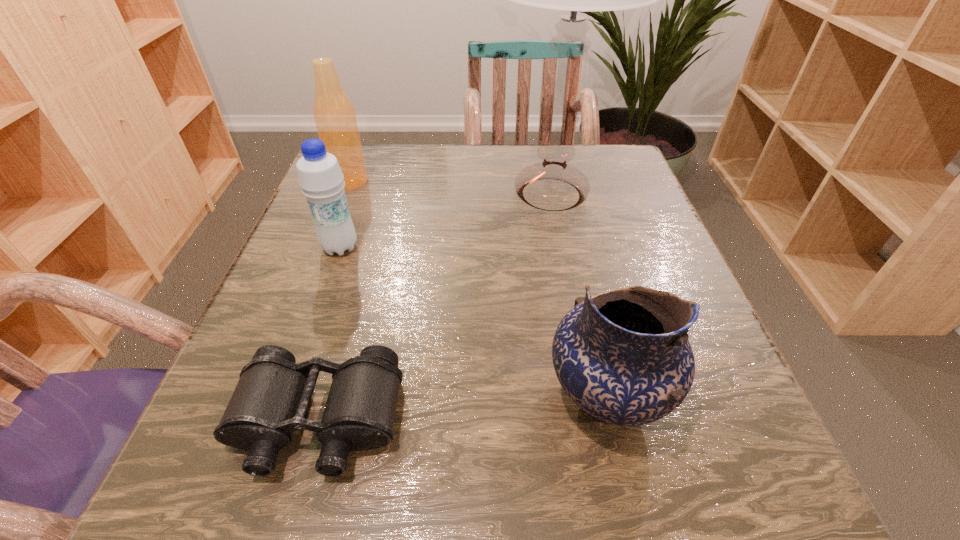
Locate an element on the screen. The height and width of the screenshot is (540, 960). object at the far right corner is located at coordinates (552, 185).

Find the location of a particular element. The width and height of the screenshot is (960, 540). object present at the near right corner is located at coordinates (623, 356).

Find the location of a particular element. vacant space at the far edge of the desktop is located at coordinates (432, 185).

I want to click on free region at the near edge of the desktop, so click(530, 510).

Locate an element on the screen. Image resolution: width=960 pixels, height=540 pixels. vacant space at the left edge of the desktop is located at coordinates (249, 329).

Where is `free point at the right edge`? Image resolution: width=960 pixels, height=540 pixels. free point at the right edge is located at coordinates click(663, 255).

Find the location of a particular element. This screenshot has width=960, height=540. vacant space at the far left corner is located at coordinates (394, 158).

Find the location of a particular element. This screenshot has height=540, width=960. free spot at the near left corner of the desktop is located at coordinates (312, 485).

Image resolution: width=960 pixels, height=540 pixels. I want to click on free space at the far right corner of the desktop, so click(589, 168).

Identify the location of free space between the tallest object and the pottery. (578, 295).